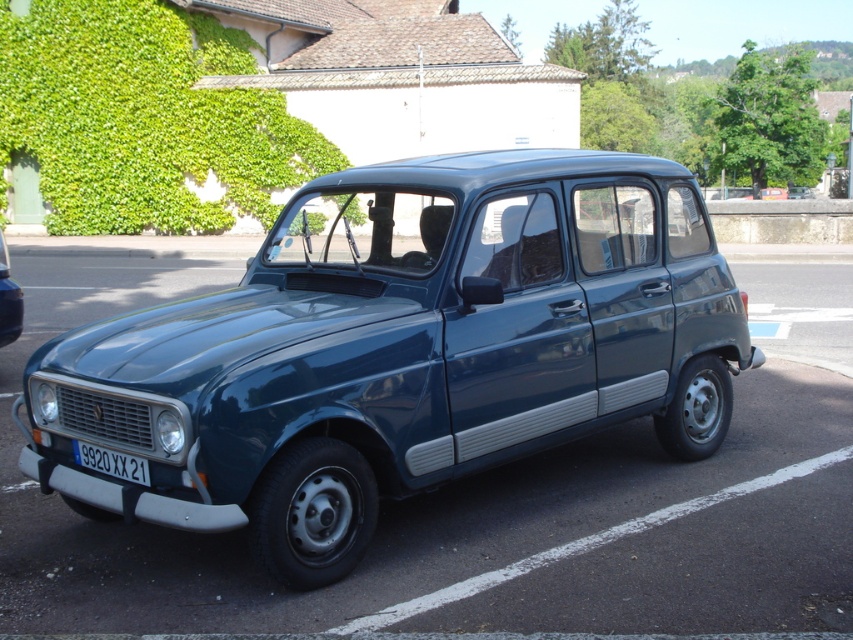
You are a photographer trying to capture the metallic blue car at lower left in your shot. However, the green leafy hedge at upper left is blocking part of the car. Can you tell me which object is bigger so I know which one to move to get a clear view?

The green leafy hedge at upper left is larger in size than the metallic blue car at lower left, so you should move the hedge to get a clear view of the metallic blue car at lower left.